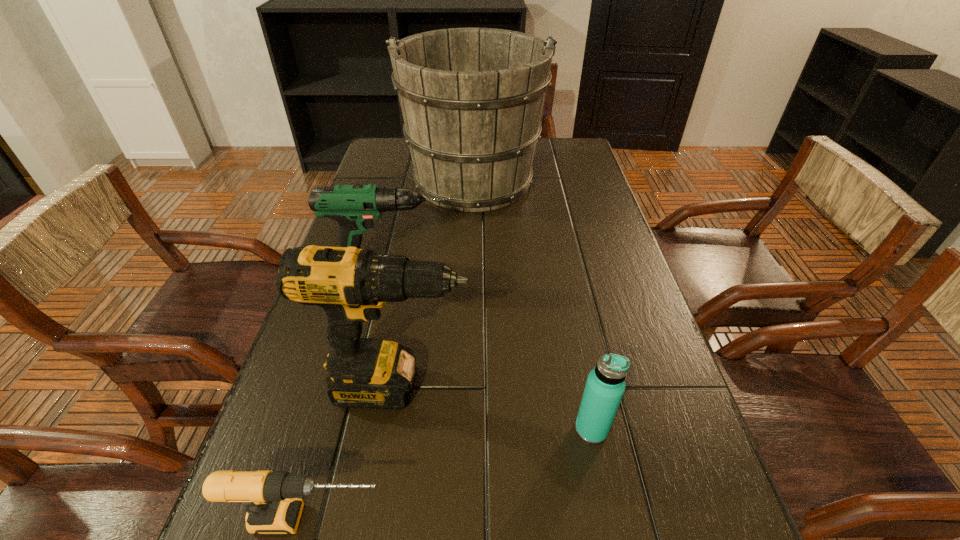
Where is `free space between the fourth tallest object and the shortest drill`? free space between the fourth tallest object and the shortest drill is located at coordinates tap(451, 474).

Find the location of `the fourth closest object to the farthest object`. the fourth closest object to the farthest object is located at coordinates (270, 498).

Identify which object is located as the second nearest to the second nearest object. Please provide its 2D coordinates. Your answer should be formatted as a tuple, i.e. [(x, y)], where the tuple contains the x and y coordinates of a point satisfying the conditions above.

[(270, 498)]

Choose which drill is the nearest neighbor to the shortest drill. Please provide its 2D coordinates. Your answer should be formatted as a tuple, i.e. [(x, y)], where the tuple contains the x and y coordinates of a point satisfying the conditions above.

[(350, 284)]

Choose which drill is the second nearest neighbor to the tallest drill. Please provide its 2D coordinates. Your answer should be formatted as a tuple, i.e. [(x, y)], where the tuple contains the x and y coordinates of a point satisfying the conditions above.

[(353, 206)]

Locate an element on the screen. The image size is (960, 540). free space that satisfies the following two spatial constraints: 1. on the handle side of the second farthest object; 2. on the left side of the water bottle is located at coordinates (360, 429).

I want to click on vacant space that satisfies the following two spatial constraints: 1. at the tip of the tallest drill; 2. on the right side of the fourth farthest object, so click(x=391, y=429).

This screenshot has height=540, width=960. Identify the location of vacant space that satisfies the following two spatial constraints: 1. on the handle side of the water bottle; 2. on the left side of the second shortest drill. click(360, 429).

What are the coordinates of `vacant area in the image that satisfies the following two spatial constraints: 1. on the handle side of the water bottle; 2. on the left side of the second shortest drill` in the screenshot? It's located at (360, 429).

Identify the location of vacant area in the image that satisfies the following two spatial constraints: 1. at the tip of the second farthest drill; 2. on the left side of the water bottle. This screenshot has height=540, width=960. (391, 429).